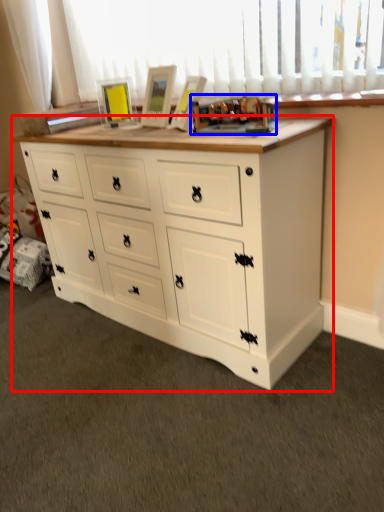
Question: Which of the following is the farthest to the observer, chest of drawers (highlighted by a red box) or toy (highlighted by a blue box)?

Choices:
 (A) chest of drawers
 (B) toy

Answer: (B)